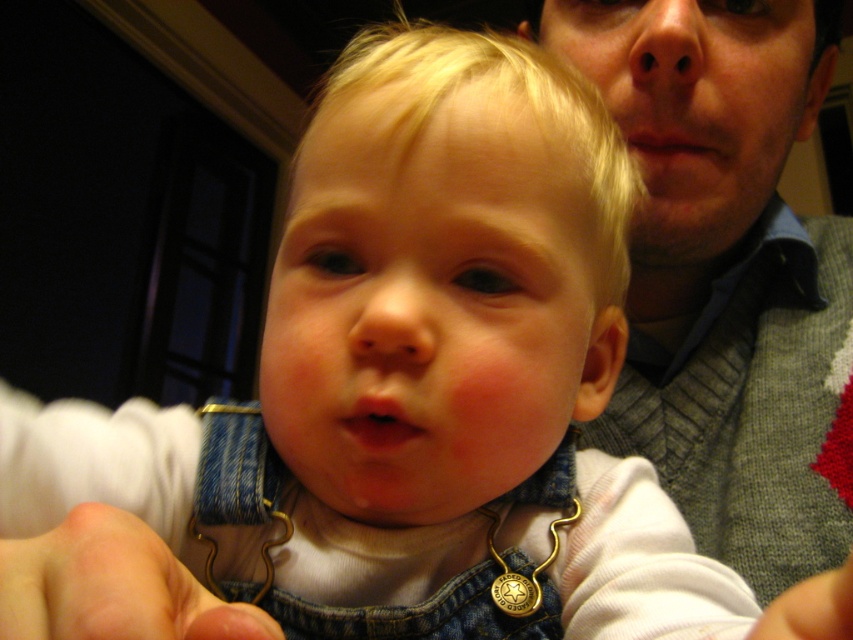
Does gray knitted sweater at upper right have a larger size compared to fuzzy white hand at lower left?

Yes.

Is point (848, 378) farther from camera compared to point (804, 595)?

Yes, point (848, 378) is behind point (804, 595).

Locate an element on the screen. Image resolution: width=853 pixels, height=640 pixels. gray knitted sweater at upper right is located at coordinates (724, 273).

Between denim at center and fuzzy white hand at lower left, which one has less height?

With less height is fuzzy white hand at lower left.

Which is below, denim at center or fuzzy white hand at lower left?

fuzzy white hand at lower left

Is point (184, 636) positioned in front of point (808, 616)?

No.

The height and width of the screenshot is (640, 853). Identify the location of denim at center. (111, 586).

From the picture: Is gray knitted sweater at upper right to the right of denim at center from the viewer's perspective?

Indeed, gray knitted sweater at upper right is positioned on the right side of denim at center.

Can you confirm if gray knitted sweater at upper right is positioned below denim at center?

No.

Does point (608, 100) come behind point (38, 538)?

Yes, it is behind point (38, 538).

At what (x,y) coordinates should I click in order to perform the action: click on gray knitted sweater at upper right. Please return your answer as a coordinate pair (x, y). Looking at the image, I should click on (724, 273).